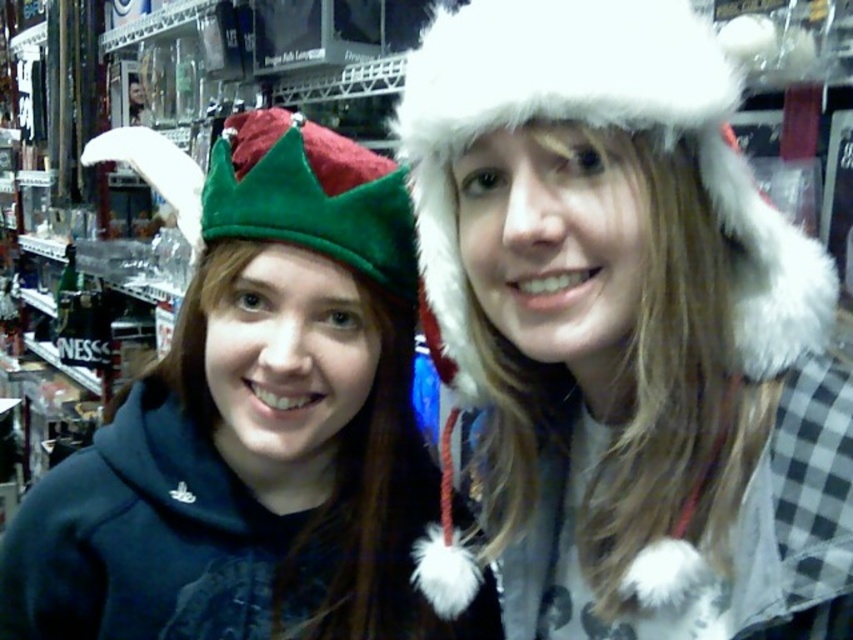
Can you confirm if white furry hat at upper right is taller than velvet green crown at upper left?

Yes, white furry hat at upper right is taller than velvet green crown at upper left.

Is white furry hat at upper right wider than velvet green crown at upper left?

No, white furry hat at upper right is not wider than velvet green crown at upper left.

Is point (766, 420) farther from camera compared to point (55, 632)?

No, it is in front of (55, 632).

Where is `white furry hat at upper right`? This screenshot has height=640, width=853. white furry hat at upper right is located at coordinates (628, 326).